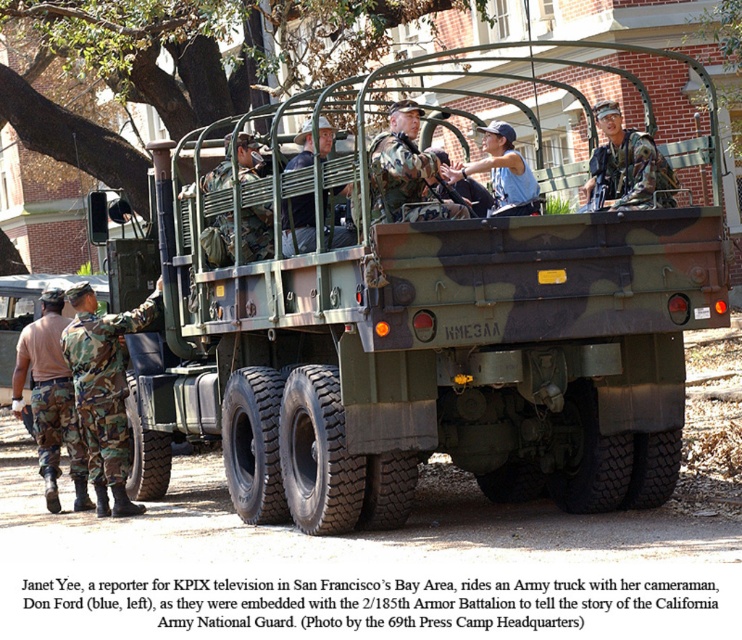
You are a photographer trying to capture a clear shot of the camouflage fabric soldier at left and the camouflage fabric helmet at center. Which object should you focus on first if you want to ensure both are in focus without adjusting your camera settings?

The camouflage fabric soldier at left is taller than the camouflage fabric helmet at center. Since the soldier is larger, focusing on them first would help ensure both are in focus as the helmet is smaller and closer to the background.

You are a photographer trying to capture a clear shot of the camouflage uniform at center and the camouflage fabric helmet at center. Since both are at the center, which one do you need to focus on more to ensure the larger object is in focus?

The camouflage uniform at center has a larger size compared to the camouflage fabric helmet at center, so you should focus more on the camouflage uniform at center to ensure the larger object is in focus.

You are a photographer trying to capture a clear shot of both the camo fabric truck at center and the camo uniform at center. Since you want to ensure both are visible in your frame, which object should you position closer to the left side of your camera view?

The camo fabric truck at center is to the left of the camo uniform at center, so to have both in frame, position the camo fabric truck at center on the left side and the camo uniform at center on the right side of the camera view.